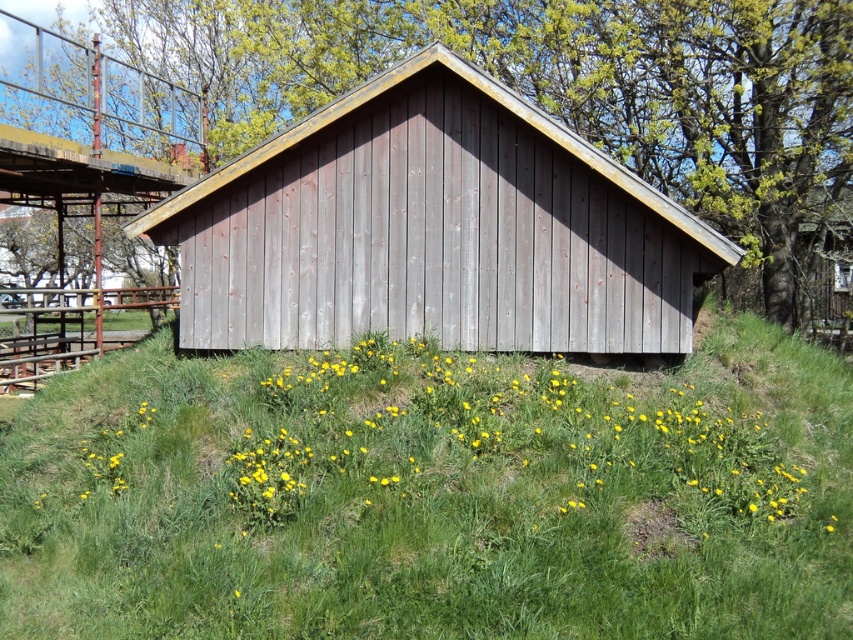
Who is taller, green grassy at center or weathered wood hut at center?

Standing taller between the two is weathered wood hut at center.

Who is positioned more to the left, green grassy at center or weathered wood hut at center?

weathered wood hut at center is more to the left.

Does point (561, 612) come closer to viewer compared to point (421, 316)?

Yes, point (561, 612) is closer to viewer.

This screenshot has height=640, width=853. What are the coordinates of `green grassy at center` in the screenshot? It's located at (433, 496).